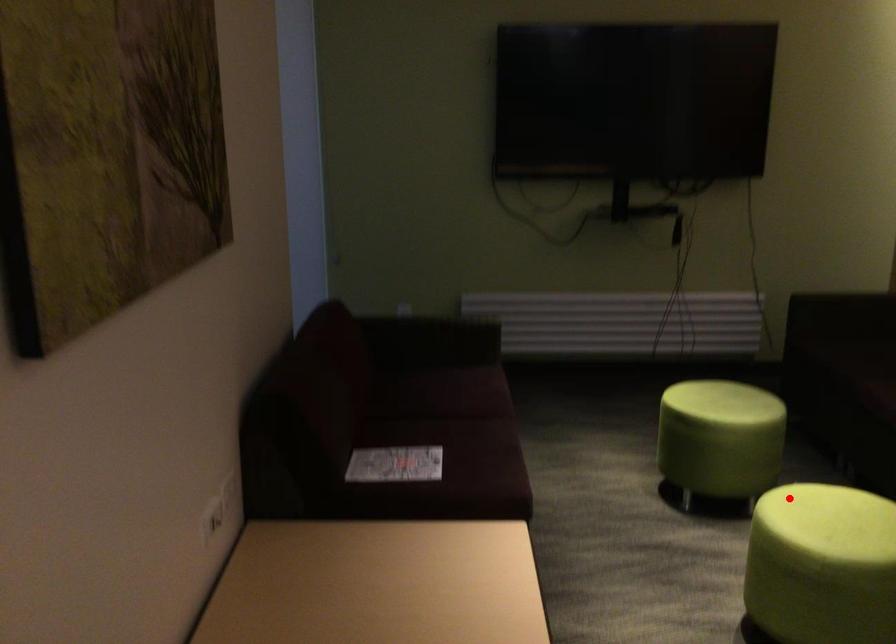
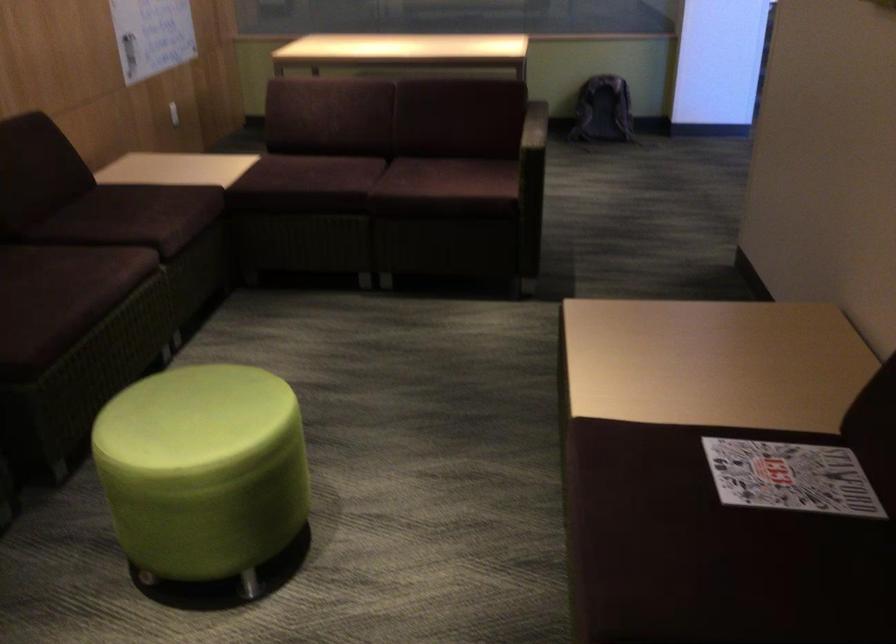
Question: I am providing you with two images of the same scene from different viewpoints. A red point is shown in image1. For the corresponding object point in image2, is it positioned nearer or farther from the camera?

Choices:
 (A) Nearer
 (B) Farther

Answer: (A)